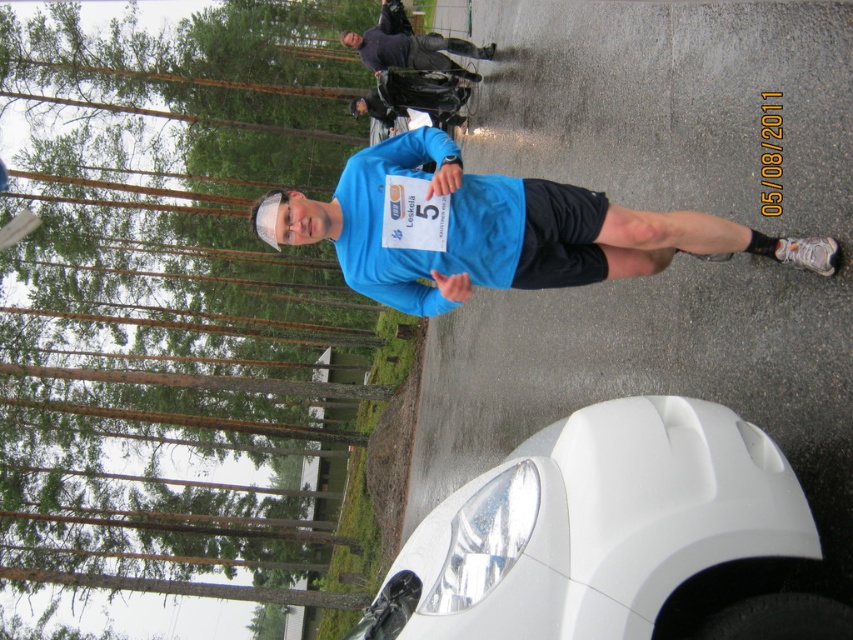
Question: Is white glossy car at lower right below blue fabric shirt at center?

Choices:
 (A) no
 (B) yes

Answer: (B)

Question: Among these points, which one is nearest to the camera?

Choices:
 (A) (x=721, y=456)
 (B) (x=376, y=241)

Answer: (A)

Question: Which point is closer to the camera taking this photo?

Choices:
 (A) (517, 625)
 (B) (410, 280)

Answer: (A)

Question: From the image, what is the correct spatial relationship of white glossy car at lower right in relation to blue fabric shirt at center?

Choices:
 (A) below
 (B) above

Answer: (A)

Question: Can you confirm if white glossy car at lower right is thinner than blue fabric shirt at center?

Choices:
 (A) no
 (B) yes

Answer: (B)